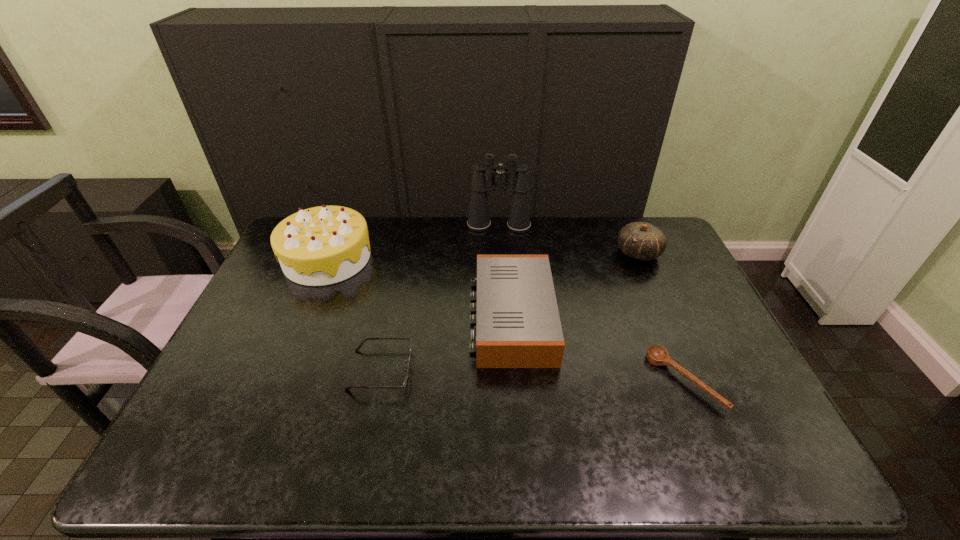
Identify which object is the fifth closest to the gourd. Please provide its 2D coordinates. Your answer should be formatted as a tuple, i.e. [(x, y)], where the tuple contains the x and y coordinates of a point satisfying the conditions above.

[(323, 245)]

Image resolution: width=960 pixels, height=540 pixels. In order to click on object that is the closest to the second shortest object in this screenshot , I will do `click(518, 325)`.